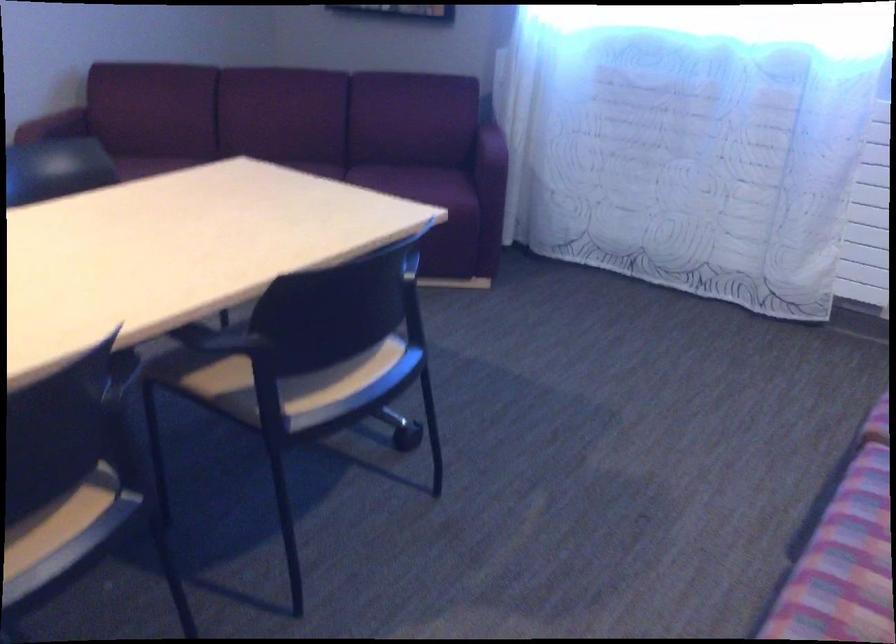
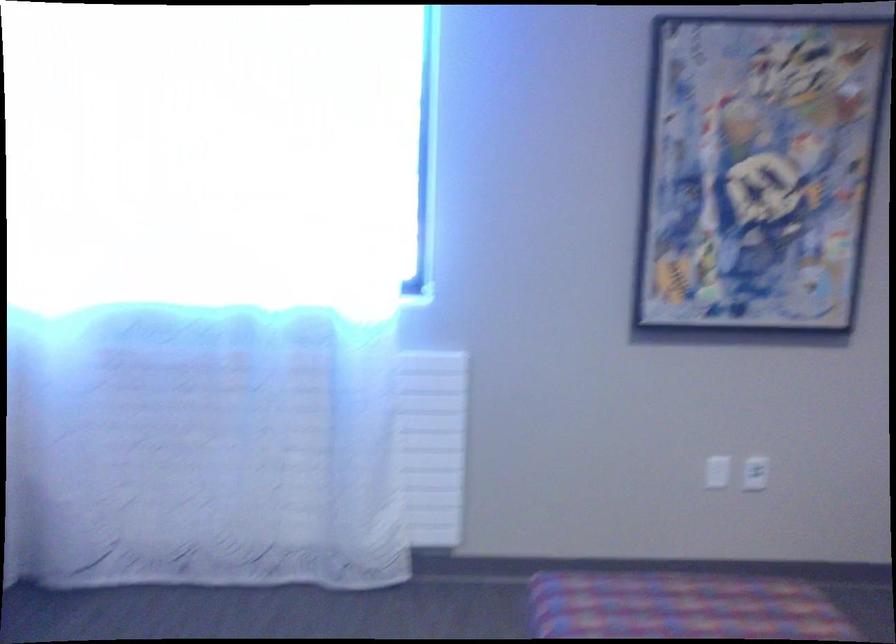
Question: The first image is from the beginning of the video and the second image is from the end. How did the camera likely rotate when shooting the video?

Choices:
 (A) Left
 (B) Right
 (C) Up
 (D) Down

Answer: (B)